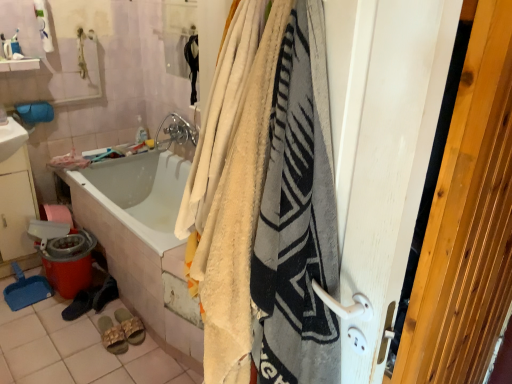
The width and height of the screenshot is (512, 384). Identify the location of free point in front of beige fabric slipper at lower center, the 1th footwear when ordered from right to left. (118, 359).